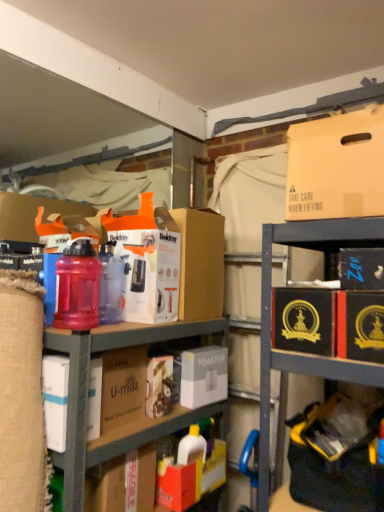
Question: Is matte cardboard box at upper right aimed at orange matte cardboard box at center, which is the second cardboard box from front to back?

Choices:
 (A) no
 (B) yes

Answer: (A)

Question: Is matte cardboard box at upper right taller than orange matte cardboard box at center, arranged as the first cardboard box when viewed from the back?

Choices:
 (A) yes
 (B) no

Answer: (B)

Question: Is matte cardboard box at upper right looking in the opposite direction of orange matte cardboard box at center, which appears as the second cardboard box when viewed from the right?

Choices:
 (A) yes
 (B) no

Answer: (B)

Question: Considering the relative positions of matte cardboard box at upper right and orange matte cardboard box at center, which appears as the second cardboard box when viewed from the right, in the image provided, is matte cardboard box at upper right to the left of orange matte cardboard box at center, which appears as the second cardboard box when viewed from the right, from the viewer's perspective?

Choices:
 (A) no
 (B) yes

Answer: (A)

Question: Is matte cardboard box at upper right positioned in front of orange matte cardboard box at center, which appears as the second cardboard box when viewed from the right?

Choices:
 (A) no
 (B) yes

Answer: (B)

Question: In terms of width, does orange matte cardboard box at center, which appears as the second cardboard box when viewed from the right, look wider or thinner when compared to matte plastic bottles at center?

Choices:
 (A) wide
 (B) thin

Answer: (B)

Question: Based on their positions, is orange matte cardboard box at center, arranged as the first cardboard box when viewed from the back, located to the left or right of matte plastic bottles at center?

Choices:
 (A) left
 (B) right

Answer: (B)

Question: From the image's perspective, is orange matte cardboard box at center, arranged as the first cardboard box when viewed from the back, located above or below matte plastic bottles at center?

Choices:
 (A) above
 (B) below

Answer: (A)

Question: Is orange matte cardboard box at center, the 1th cardboard box when ordered from left to right, inside or outside of matte plastic bottles at center?

Choices:
 (A) inside
 (B) outside

Answer: (B)

Question: Is white matte toaster at center, arranged as the 1th storage box when viewed from the left, to the left or to the right of translucent plastic water bottle at left in the image?

Choices:
 (A) left
 (B) right

Answer: (B)

Question: From the image's perspective, is white matte toaster at center, which is the third storage box in right-to-left order, positioned above or below translucent plastic water bottle at left?

Choices:
 (A) above
 (B) below

Answer: (B)

Question: Considering their positions, is white matte toaster at center, which ranks as the 1th storage box in bottom-to-top order, located in front of or behind translucent plastic water bottle at left?

Choices:
 (A) front
 (B) behind

Answer: (B)

Question: In terms of size, does white matte toaster at center, which is the third storage box in right-to-left order, appear bigger or smaller than translucent plastic water bottle at left?

Choices:
 (A) small
 (B) big

Answer: (B)

Question: From a real-world perspective, is gold embossed box at right, which appears as the first cardboard box when viewed from the front, physically located above or below white matte toaster at center, arranged as the 1th storage box when viewed from the left?

Choices:
 (A) above
 (B) below

Answer: (A)

Question: Considering the relative positions of gold embossed box at right, placed as the second cardboard box when sorted from left to right, and white matte toaster at center, arranged as the 3th storage box when viewed from the top, in the image provided, is gold embossed box at right, placed as the second cardboard box when sorted from left to right, to the left or to the right of white matte toaster at center, arranged as the 3th storage box when viewed from the top,?

Choices:
 (A) right
 (B) left

Answer: (A)